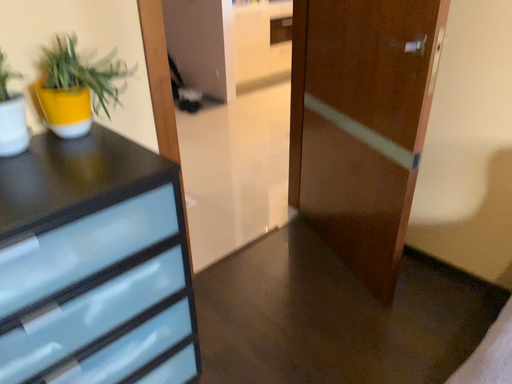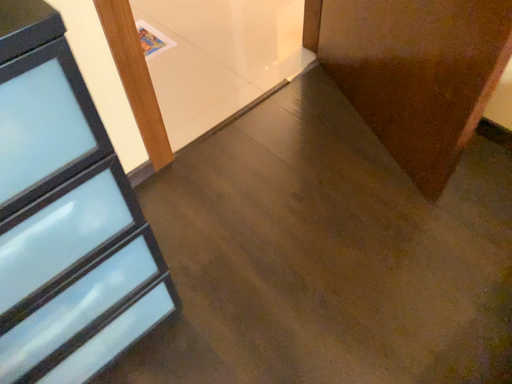
Question: Which way did the camera rotate in the video?

Choices:
 (A) rotated upward
 (B) rotated downward

Answer: (B)